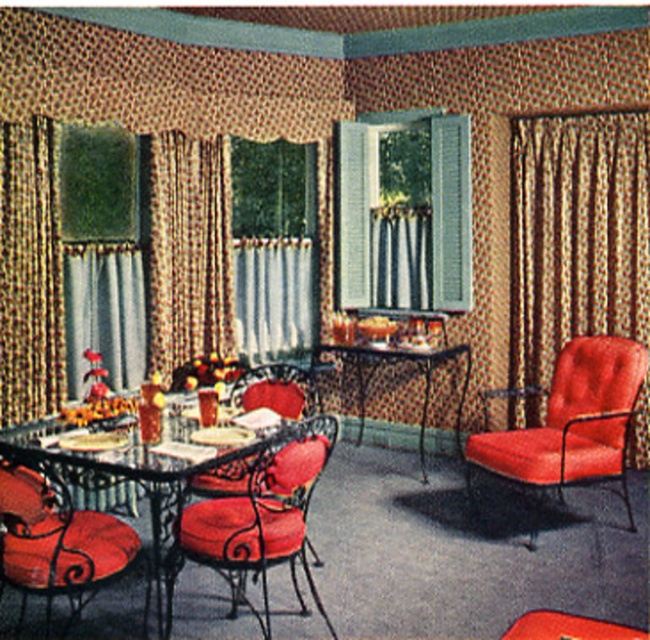
Question: Considering the real-world distances, which object is farthest from the metallic black table at center?

Choices:
 (A) textured beige curtain at left
 (B) velvet red chair at center
 (C) gold textured curtain at right

Answer: (A)

Question: Estimate the real-world distances between objects in this image. Which object is closer to the velvet orange armchair at right?

Choices:
 (A) brown textured curtain at left
 (B) white sheer curtain at center
 (C) textured beige curtain at left

Answer: (B)

Question: Can you confirm if brown textured curtain at left is positioned above white sheer curtain at center?

Choices:
 (A) yes
 (B) no

Answer: (A)

Question: Based on their relative distances, which object is farther from the brown textured curtain at left?

Choices:
 (A) metallic black table at center
 (B) textured beige curtain at left
 (C) gold textured curtain at right

Answer: (C)

Question: Can you confirm if gold textured curtain at right is positioned to the left of textured beige curtain at left?

Choices:
 (A) no
 (B) yes

Answer: (A)

Question: Can you confirm if gold textured curtain at right is positioned below textured beige curtain at left?

Choices:
 (A) yes
 (B) no

Answer: (B)